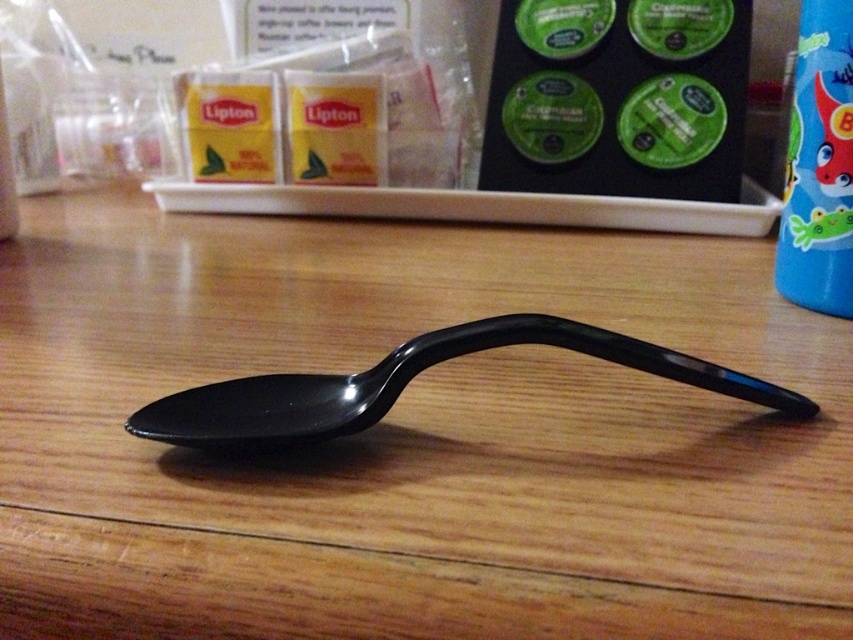
You are arranging items on the wooden table at center and the blue glossy bottle at right. If you have a rectangular box that is 12 inches long, which surface can accommodate it without exceeding the width?

The wooden table at center can accommodate the rectangular box since its width is greater than the blue glossy bottle at right.